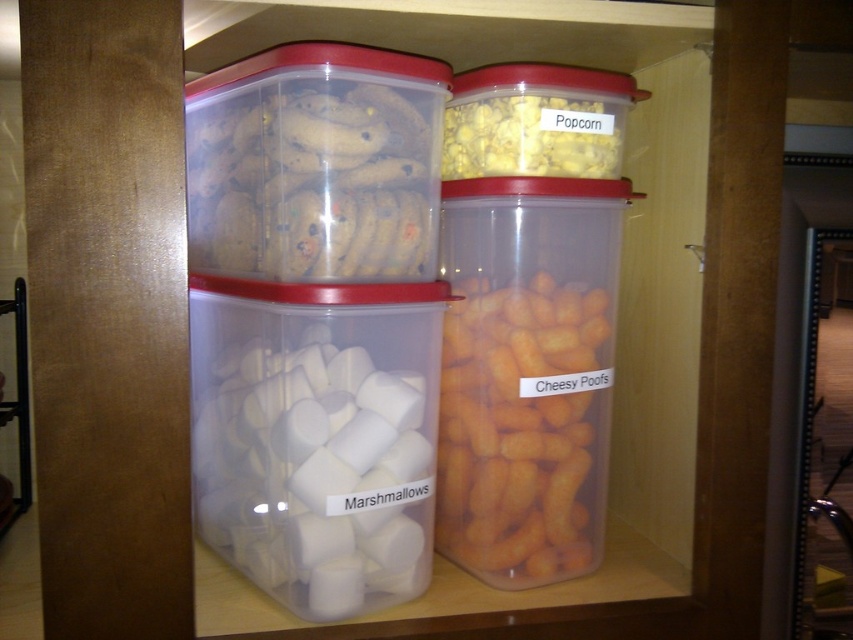
Question: Among these points, which one is farthest from the camera?

Choices:
 (A) (440, 413)
 (B) (318, 403)
 (C) (509, 120)
 (D) (422, 266)

Answer: (A)

Question: Can you confirm if white matte marshmallows at center is smaller than translucent yellowish-orange snack at center-right?

Choices:
 (A) no
 (B) yes

Answer: (A)

Question: Considering the real-world distances, which object is closest to the translucent plastic cookies at upper left?

Choices:
 (A) yellow popcorn at center
 (B) translucent yellowish-orange snack at center-right

Answer: (A)

Question: Which of the following is the closest to the observer?

Choices:
 (A) translucent yellowish-orange snack at center-right
 (B) yellow popcorn at center
 (C) translucent plastic cookies at upper left
 (D) white matte marshmallows at center

Answer: (C)

Question: Is white matte marshmallows at center smaller than yellow popcorn at center?

Choices:
 (A) yes
 (B) no

Answer: (B)

Question: Does white matte marshmallows at center appear on the right side of translucent yellowish-orange snack at center-right?

Choices:
 (A) no
 (B) yes

Answer: (A)